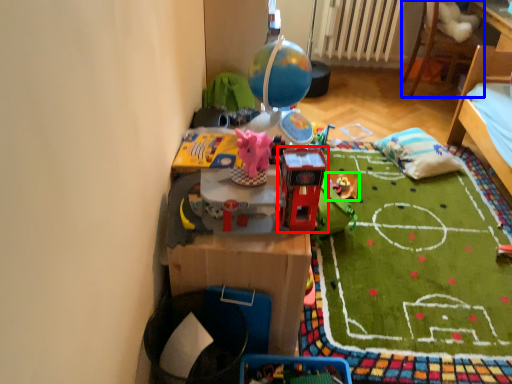
Question: Based on their relative distances, which object is farther from toy (highlighted by a red box)? Choose from furniture (highlighted by a blue box) and toy (highlighted by a green box).

Choices:
 (A) furniture
 (B) toy

Answer: (A)